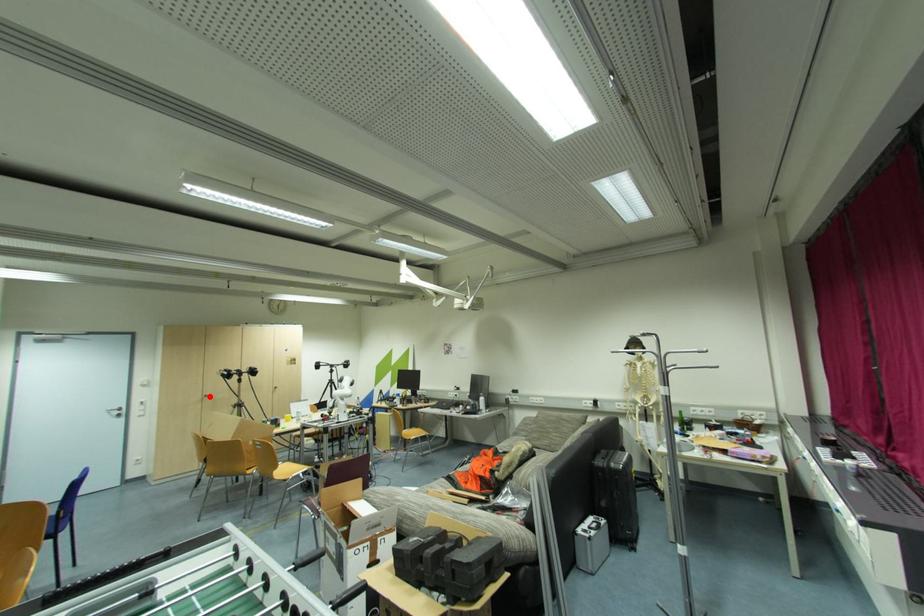
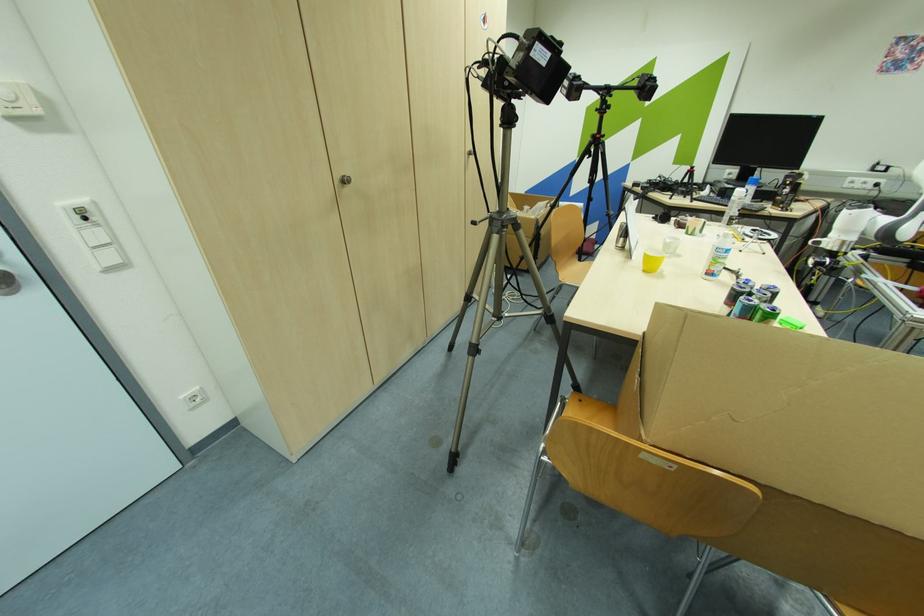
The point at the highlighted location is marked in the first image. Where is the corresponding point in the second image?

(348, 182)